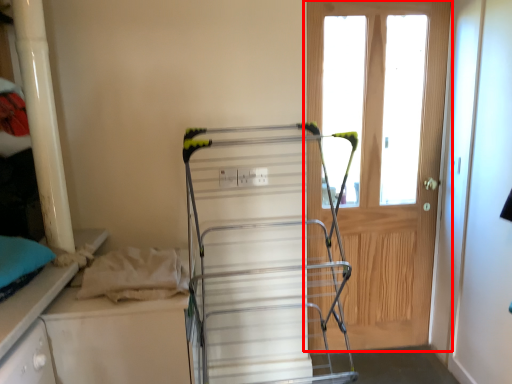
Question: In this image, where is door (annotated by the red box) located relative to wide?

Choices:
 (A) right
 (B) left

Answer: (A)